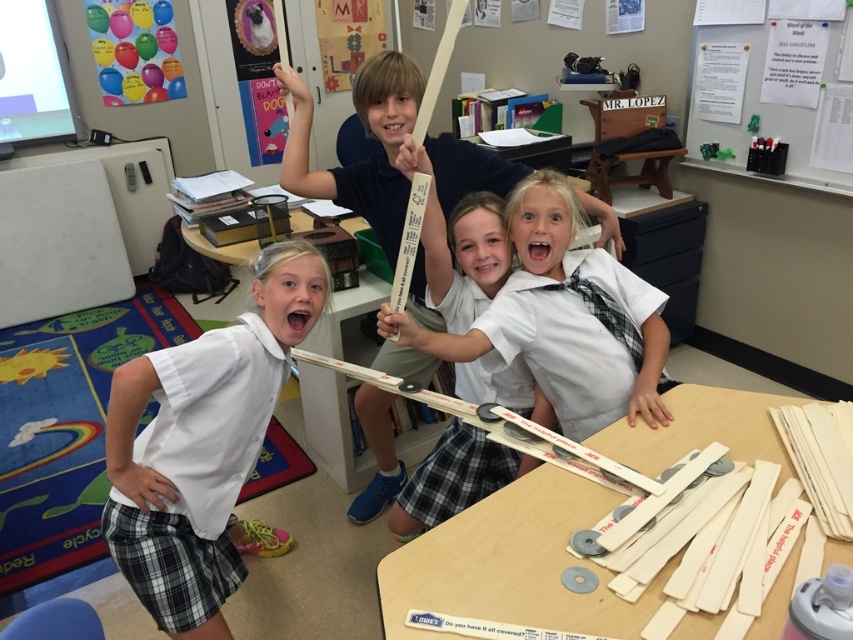
Locate an element on the screen. white glossy shirt at center is located at coordinates (204, 448).

Between white glossy shirt at center and white cardboard strips at center, which one has less height?

Standing shorter between the two is white cardboard strips at center.

Identify the location of white glossy shirt at center. This screenshot has height=640, width=853. (204, 448).

This screenshot has width=853, height=640. Identify the location of white glossy shirt at center. (204, 448).

Is white glossy shirt at center shorter than white glossy tie at center?

No, white glossy shirt at center is not shorter than white glossy tie at center.

Does white glossy shirt at center have a greater width compared to white glossy tie at center?

Incorrect, white glossy shirt at center's width does not surpass white glossy tie at center's.

At what (x,y) coordinates should I click in order to perform the action: click on white glossy shirt at center. Please return your answer as a coordinate pair (x, y). This screenshot has height=640, width=853. Looking at the image, I should click on (204, 448).

Measure the distance between white cardboard strips at center and camera.

white cardboard strips at center and camera are 37.45 inches apart.

Who is lower down, white cardboard strips at center or white glossy tie at center?

white cardboard strips at center is lower down.

Find the location of a particular element. This screenshot has width=853, height=640. white cardboard strips at center is located at coordinates (512, 564).